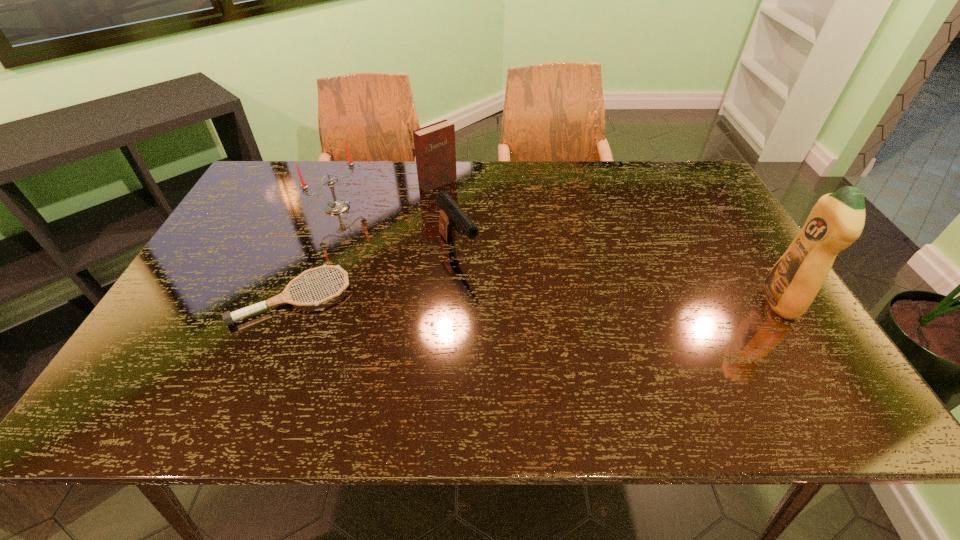
Locate an element on the screen. The height and width of the screenshot is (540, 960). diary that is at the far edge is located at coordinates (435, 152).

In order to click on object that is at the left edge in this screenshot , I will do [x=228, y=317].

Where is `object present at the right edge`? The height and width of the screenshot is (540, 960). object present at the right edge is located at coordinates (837, 219).

I want to click on free spot at the far edge of the desktop, so click(475, 195).

Image resolution: width=960 pixels, height=540 pixels. I want to click on free space at the near edge, so click(x=579, y=353).

Locate an element on the screen. vacant space at the left edge of the desktop is located at coordinates (248, 284).

The image size is (960, 540). I want to click on vacant space at the right edge of the desktop, so click(687, 231).

Find the location of a particular element. free space at the near left corner is located at coordinates (190, 353).

At what (x,y) coordinates should I click in order to perform the action: click on vacant space at the far right corner of the desktop. Please return your answer as a coordinate pair (x, y). Image resolution: width=960 pixels, height=540 pixels. Looking at the image, I should click on (681, 161).

At what (x,y) coordinates should I click in order to perform the action: click on free spot at the near right corner of the desktop. Please return your answer as a coordinate pair (x, y). Looking at the image, I should click on (776, 358).